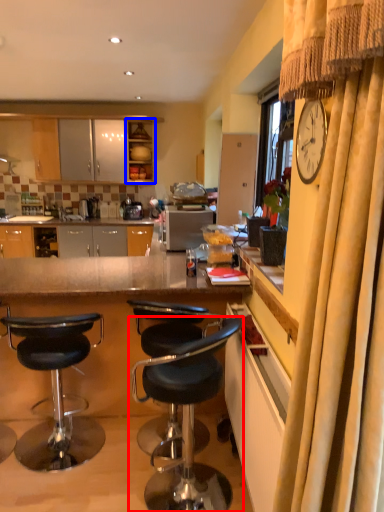
Question: Among these objects, which one is farthest to the camera, chair (highlighted by a red box) or cabinetry (highlighted by a blue box)?

Choices:
 (A) chair
 (B) cabinetry

Answer: (B)